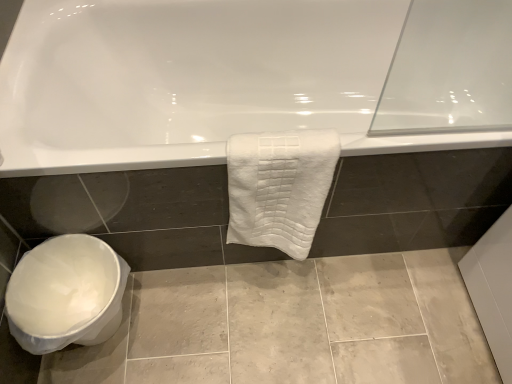
Find the location of a particular element. The width and height of the screenshot is (512, 384). vacant space to the right of white plastic toilet bowl at lower left is located at coordinates (181, 321).